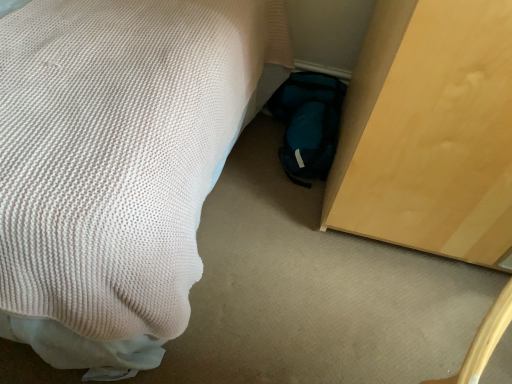
Question: Visually, is teal fabric bag at lower center positioned to the left or to the right of white knitted bed at lower left?

Choices:
 (A) left
 (B) right

Answer: (B)

Question: Which is correct: teal fabric bag at lower center is inside white knitted bed at lower left, or outside of it?

Choices:
 (A) inside
 (B) outside

Answer: (B)

Question: Considering the positions of teal fabric bag at lower center and white knitted bed at lower left in the image, is teal fabric bag at lower center bigger or smaller than white knitted bed at lower left?

Choices:
 (A) big
 (B) small

Answer: (B)

Question: From the image's perspective, is white knitted bed at lower left located above or below teal fabric bag at lower center?

Choices:
 (A) above
 (B) below

Answer: (A)

Question: From a real-world perspective, is white knitted bed at lower left positioned above or below teal fabric bag at lower center?

Choices:
 (A) below
 (B) above

Answer: (B)

Question: Looking at the image, does white knitted bed at lower left seem bigger or smaller compared to teal fabric bag at lower center?

Choices:
 (A) small
 (B) big

Answer: (B)

Question: Considering the positions of white knitted bed at lower left and teal fabric bag at lower center in the image, is white knitted bed at lower left wider or thinner than teal fabric bag at lower center?

Choices:
 (A) wide
 (B) thin

Answer: (A)